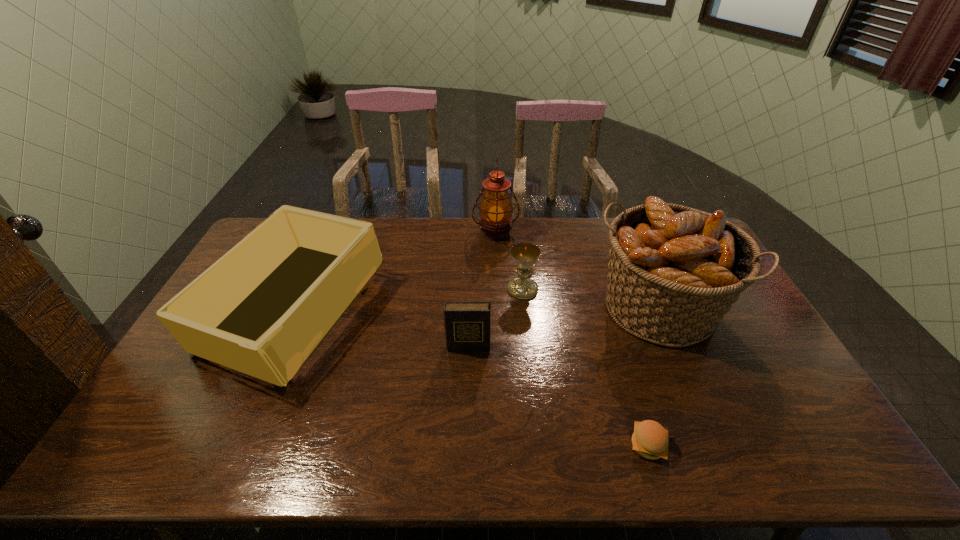
Where is `oil lamp`? oil lamp is located at coordinates (496, 208).

Where is `basket`? The width and height of the screenshot is (960, 540). basket is located at coordinates (674, 271).

Locate an element on the screen. The image size is (960, 540). the fourth shortest object is located at coordinates (262, 309).

You are a GUI agent. You are given a task and a screenshot of the screen. Output one action in this format:
    pyautogui.click(x=<x>, y=<y>)
    Task: Click on the box
    
    Given the screenshot: What is the action you would take?
    coord(262,309)

At what (x,y) coordinates should I click in order to perform the action: click on diary. Please return your answer as a coordinate pair (x, y). Image resolution: width=960 pixels, height=540 pixels. Looking at the image, I should click on (467, 324).

Image resolution: width=960 pixels, height=540 pixels. What are the coordinates of `chalice` in the screenshot? It's located at (525, 255).

This screenshot has width=960, height=540. What are the coordinates of `hamburger` in the screenshot? It's located at (650, 439).

The height and width of the screenshot is (540, 960). What are the coordinates of `the shortest object` in the screenshot? It's located at (650, 439).

This screenshot has width=960, height=540. I want to click on vacant space located 0.070m on the left of the oil lamp, so click(454, 233).

The height and width of the screenshot is (540, 960). Identify the location of free space located on the left of the basket. (541, 309).